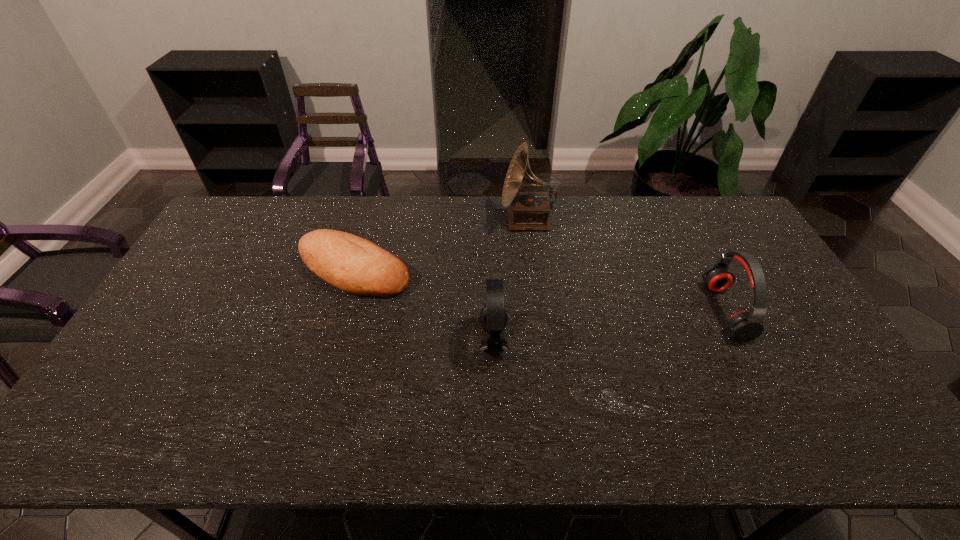
Find the location of a particular element. This screenshot has height=540, width=960. phonograph record is located at coordinates (529, 211).

The width and height of the screenshot is (960, 540). Find the location of `the third object from left to right`. the third object from left to right is located at coordinates (529, 211).

Find the location of a particular element. Image resolution: width=960 pixels, height=540 pixels. the left earphone is located at coordinates (493, 318).

In order to click on the rightmost object in this screenshot , I will do `click(744, 326)`.

Locate an element on the screen. Image resolution: width=960 pixels, height=540 pixels. bread is located at coordinates (354, 265).

Find the location of a particular element. the leftmost object is located at coordinates (354, 265).

Locate an element on the screen. The image size is (960, 540). free space located on the horn of the second object from right to left is located at coordinates pos(465,221).

You are a GUI agent. You are given a task and a screenshot of the screen. Output one action in this format:
    pyautogui.click(x=<x>, y=<y>)
    Task: Click on the vacant region located on the horn of the second object from right to left
    
    Given the screenshot: What is the action you would take?
    pyautogui.click(x=485, y=221)

Locate an element on the screen. free space located on the horn of the second object from right to left is located at coordinates (479, 221).

I want to click on free space located on the ear cups of the third object from right to left, so click(409, 341).